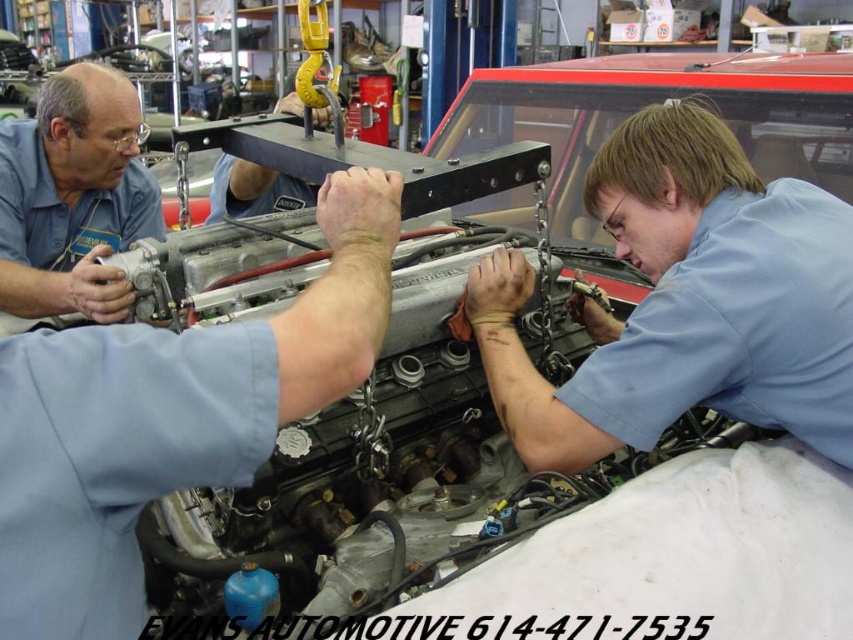
Question: Can you confirm if matte silver engine at center is positioned to the left of matte blue shirt at upper left?

Choices:
 (A) no
 (B) yes

Answer: (A)

Question: Which point is farther to the camera?

Choices:
 (A) (611, 369)
 (B) (32, 282)

Answer: (B)

Question: Does matte silver engine at center appear on the right side of matte blue shirt at upper left?

Choices:
 (A) no
 (B) yes

Answer: (B)

Question: Which point is farther to the camera?

Choices:
 (A) matte blue shirt at upper left
 (B) matte silver engine at center

Answer: (A)

Question: Can you confirm if matte silver engine at center is positioned to the left of matte blue shirt at upper left?

Choices:
 (A) yes
 (B) no

Answer: (B)